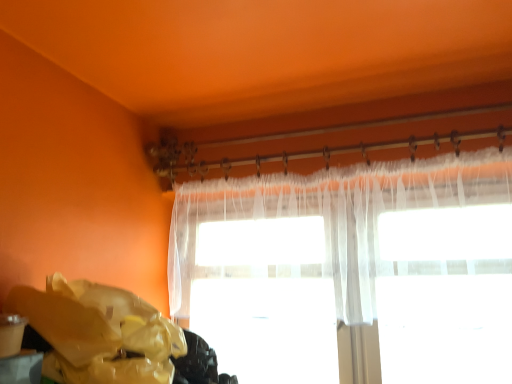
Question: Is the position of yellow plastic bag at lower left more distant than that of sheer white curtain at upper center?

Choices:
 (A) yes
 (B) no

Answer: (B)

Question: Is yellow plastic bag at lower left completely or partially outside of sheer white curtain at upper center?

Choices:
 (A) yes
 (B) no

Answer: (A)

Question: Is yellow plastic bag at lower left taller than sheer white curtain at upper center?

Choices:
 (A) yes
 (B) no

Answer: (B)

Question: Can you confirm if yellow plastic bag at lower left is bigger than sheer white curtain at upper center?

Choices:
 (A) no
 (B) yes

Answer: (A)

Question: From the image's perspective, is yellow plastic bag at lower left located beneath sheer white curtain at upper center?

Choices:
 (A) yes
 (B) no

Answer: (A)

Question: From a real-world perspective, is yellow plastic bag at lower left below sheer white curtain at upper center?

Choices:
 (A) yes
 (B) no

Answer: (A)

Question: Does sheer white curtain at upper center lie behind yellow plastic bag at lower left?

Choices:
 (A) no
 (B) yes

Answer: (B)

Question: From the image's perspective, is sheer white curtain at upper center on top of yellow plastic bag at lower left?

Choices:
 (A) no
 (B) yes

Answer: (B)

Question: Does sheer white curtain at upper center have a smaller size compared to yellow plastic bag at lower left?

Choices:
 (A) no
 (B) yes

Answer: (A)

Question: Could you tell me if sheer white curtain at upper center is turned towards yellow plastic bag at lower left?

Choices:
 (A) yes
 (B) no

Answer: (A)

Question: Does sheer white curtain at upper center appear on the right side of yellow plastic bag at lower left?

Choices:
 (A) yes
 (B) no

Answer: (A)

Question: Can you confirm if sheer white curtain at upper center is taller than yellow plastic bag at lower left?

Choices:
 (A) yes
 (B) no

Answer: (A)

Question: From a real-world perspective, relative to yellow plastic bag at lower left, is sheer white curtain at upper center vertically above or below?

Choices:
 (A) below
 (B) above

Answer: (B)